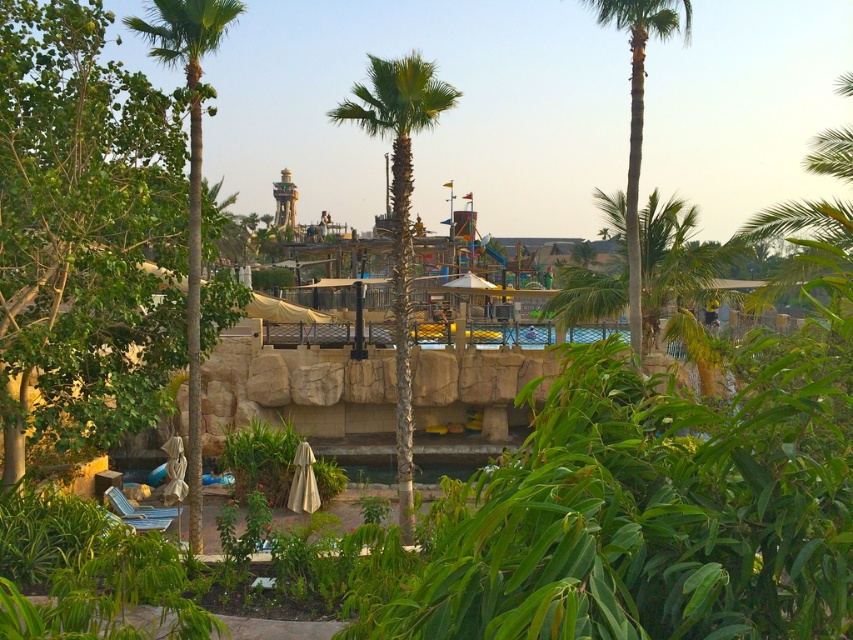
Question: Which point appears farthest from the camera in this image?

Choices:
 (A) (198, 193)
 (B) (595, 0)
 (C) (398, 227)

Answer: (B)

Question: Can you confirm if green textured palm tree at center is smaller than green leafy palm tree at right?

Choices:
 (A) no
 (B) yes

Answer: (A)

Question: Based on their relative distances, which object is farther from the green leafy palm tree at left?

Choices:
 (A) green textured palm tree at center
 (B) green leafy palm tree at right

Answer: (B)

Question: Can you confirm if green leafy tree at center is thinner than green leafy palm tree at left?

Choices:
 (A) no
 (B) yes

Answer: (B)

Question: Is green leafy palm tree at left smaller than green leafy palm tree at right?

Choices:
 (A) yes
 (B) no

Answer: (B)

Question: Which object is positioned farthest from the green leafy tree at center?

Choices:
 (A) green textured palm tree at center
 (B) green leafy palm tree at right
 (C) green leafy palm tree at left

Answer: (B)